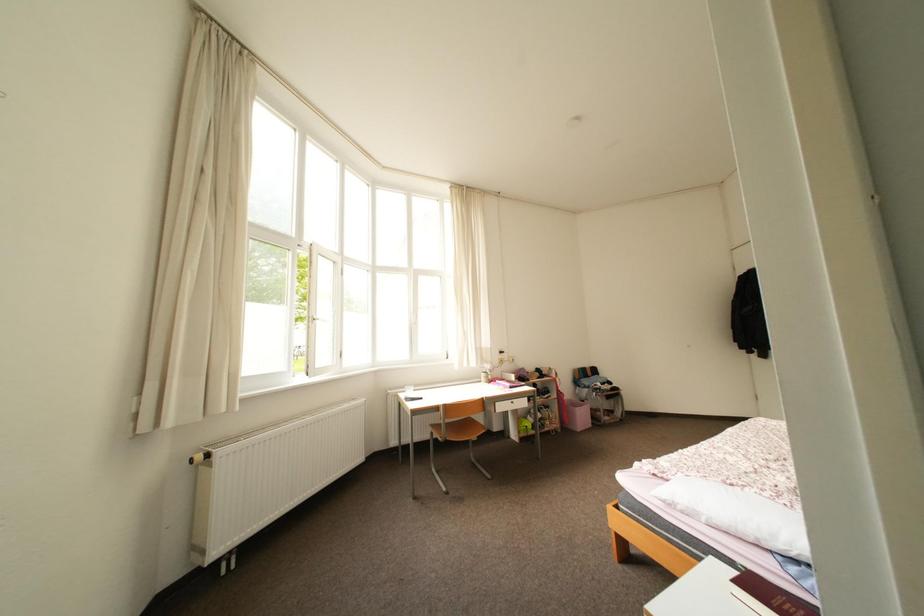
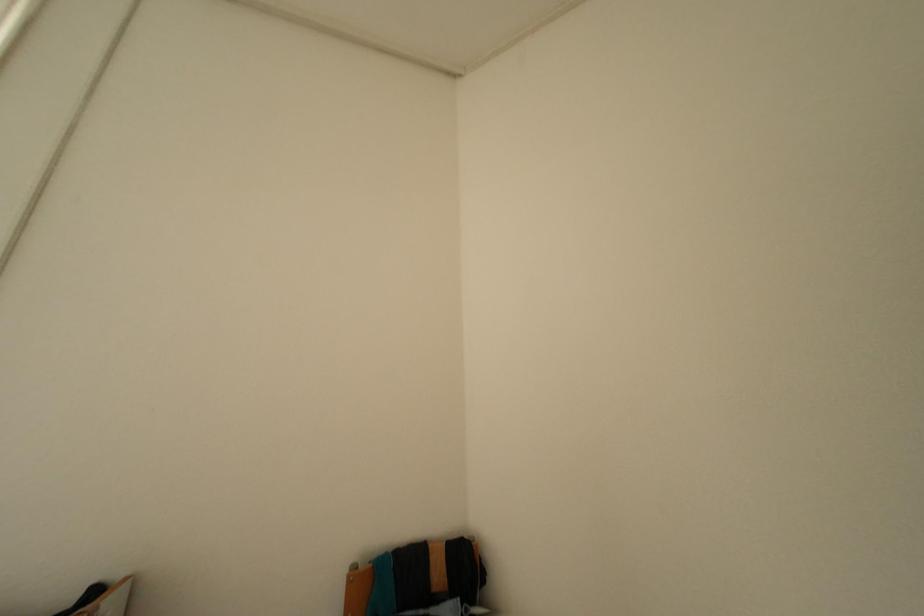
Which direction would the cameraman need to move to produce the second image?

The cameraman moved toward right, forward.